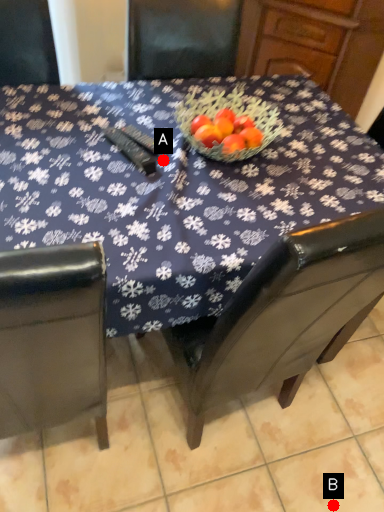
Question: Two points are circled on the image, labeled by A and B beside each circle. Which of the following is the farthest from the observer?

Choices:
 (A) A is further
 (B) B is further

Answer: (B)